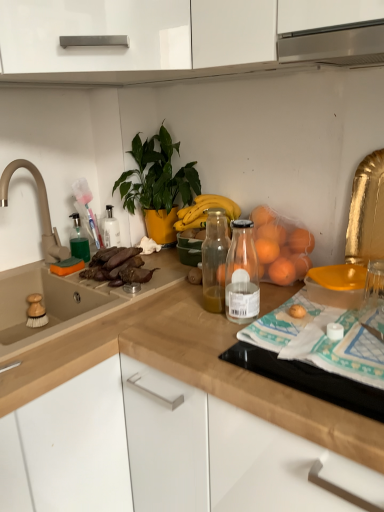
Question: From the image's perspective, is beige matte faucet at left positioned above or below green glossy plant at upper center?

Choices:
 (A) below
 (B) above

Answer: (A)

Question: Is beige matte faucet at left spatially inside green glossy plant at upper center, or outside of it?

Choices:
 (A) outside
 (B) inside

Answer: (A)

Question: Based on their relative distances, which object is farther from the beige matte faucet at left?

Choices:
 (A) green translucent soap dispenser at left
 (B) brown matte sweet potatoes at sink
 (C) green glossy plant at upper center
 (D) wooden at left, marked as the first countertop in a top-to-bottom arrangement
 (E) wooden at upper center, which ranks as the second countertop in top-to-bottom order

Answer: (E)

Question: Based on their relative distances, which object is farther from the wooden at left, marked as the first countertop in a top-to-bottom arrangement?

Choices:
 (A) green glossy plant at upper center
 (B) beige matte faucet at left
 (C) brown matte sweet potatoes at sink
 (D) wooden at upper center, which ranks as the second countertop in top-to-bottom order
 (E) green translucent soap dispenser at left

Answer: (B)